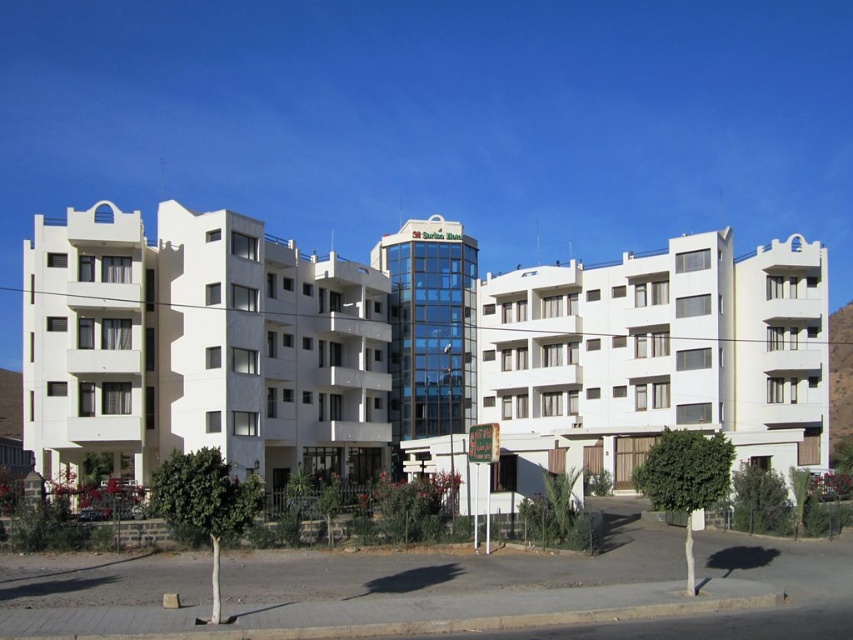
Is white smooth building at center to the right of white matte building at center from the viewer's perspective?

Incorrect, white smooth building at center is not on the right side of white matte building at center.

In the scene shown: Does white smooth building at center have a greater height compared to white matte building at center?

Yes, white smooth building at center is taller than white matte building at center.

Is point (461, 356) less distant than point (685, 352)?

No, (461, 356) is further to viewer.

Identify the location of white smooth building at center. Image resolution: width=853 pixels, height=640 pixels. (409, 349).

Does white smooth building at left appear on the right side of white matte building at center?

No, white smooth building at left is not to the right of white matte building at center.

Who is lower down, white smooth building at left or white matte building at center?

white matte building at center is below.

Does point (236, 275) come farther from viewer compared to point (590, 440)?

That is False.

This screenshot has width=853, height=640. What are the coordinates of `white smooth building at left` in the screenshot? It's located at (199, 348).

Which is in front, point (421, 314) or point (273, 461)?

Point (273, 461) is in front.

Based on the photo, between white smooth building at center and white smooth building at left, which one is positioned higher?

white smooth building at left is higher up.

Is point (276, 298) more distant than point (79, 282)?

That is True.

Locate an element on the screen. white smooth building at center is located at coordinates (409, 349).